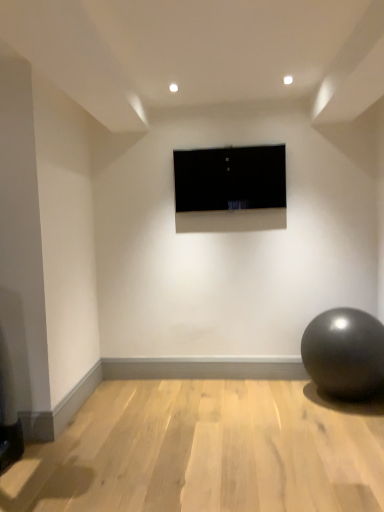
Describe the element at coordinates (230, 178) in the screenshot. I see `black glossy tv at center` at that location.

At what (x,y) coordinates should I click in order to perform the action: click on black glossy tv at center. Please return your answer as a coordinate pair (x, y). The width and height of the screenshot is (384, 512). Looking at the image, I should click on (230, 178).

Locate an element on the screen. shiny metallic ball at lower right is located at coordinates (344, 353).

Measure the distance between shiny metallic ball at lower right and camera.

2.86 meters.

The height and width of the screenshot is (512, 384). What do you see at coordinates (344, 353) in the screenshot?
I see `shiny metallic ball at lower right` at bounding box center [344, 353].

The height and width of the screenshot is (512, 384). Find the location of `black glossy tv at center`. black glossy tv at center is located at coordinates (230, 178).

Is shiny metallic ball at lower right to the left of black glossy tv at center from the viewer's perspective?

In fact, shiny metallic ball at lower right is to the right of black glossy tv at center.

Is shiny metallic ball at lower right behind black glossy tv at center?

No, shiny metallic ball at lower right is closer to the viewer.

Between point (324, 331) and point (241, 178), which one is positioned behind?

Positioned behind is point (241, 178).

From the image's perspective, who appears lower, shiny metallic ball at lower right or black glossy tv at center?

shiny metallic ball at lower right is shown below in the image.

From a real-world perspective, between shiny metallic ball at lower right and black glossy tv at center, who is vertically higher?

In real-world perspective, black glossy tv at center is above.

Considering the sizes of objects shiny metallic ball at lower right and black glossy tv at center in the image provided, who is thinner, shiny metallic ball at lower right or black glossy tv at center?

black glossy tv at center.

Is shiny metallic ball at lower right taller than black glossy tv at center?

Correct, shiny metallic ball at lower right is much taller as black glossy tv at center.

Can you confirm if shiny metallic ball at lower right is smaller than black glossy tv at center?

No, shiny metallic ball at lower right is not smaller than black glossy tv at center.

Can we say shiny metallic ball at lower right lies outside black glossy tv at center?

That's correct, shiny metallic ball at lower right is outside of black glossy tv at center.

Are shiny metallic ball at lower right and black glossy tv at center making contact?

No, shiny metallic ball at lower right is not making contact with black glossy tv at center.

Is shiny metallic ball at lower right oriented towards black glossy tv at center?

No, shiny metallic ball at lower right is not facing towards black glossy tv at center.

How many degrees apart are the facing directions of shiny metallic ball at lower right and black glossy tv at center?

The facing directions of shiny metallic ball at lower right and black glossy tv at center are 1.16 degrees apart.

You are a GUI agent. You are given a task and a screenshot of the screen. Output one action in this format:
    pyautogui.click(x=<x>, y=<y>)
    Task: Click on the television above the shiny metallic ball at lower right (from a real-world perspective)
    
    Given the screenshot: What is the action you would take?
    pyautogui.click(x=230, y=178)

In the scene shown: In the image, is black glossy tv at center on the left side or the right side of shiny metallic ball at lower right?

Clearly, black glossy tv at center is on the left of shiny metallic ball at lower right in the image.

Which object is closer to the camera taking this photo, black glossy tv at center or shiny metallic ball at lower right?

shiny metallic ball at lower right.

Which is closer to the camera, (274, 169) or (324, 350)?

The point (324, 350) is closer.

From the image's perspective, is black glossy tv at center on shiny metallic ball at lower right?

Yes, from the image's perspective, black glossy tv at center is on top of shiny metallic ball at lower right.

From a real-world perspective, is black glossy tv at center above or below shiny metallic ball at lower right?

From a real-world perspective, black glossy tv at center is physically above shiny metallic ball at lower right.

Between black glossy tv at center and shiny metallic ball at lower right, which one has smaller width?

With smaller width is black glossy tv at center.

Can you confirm if black glossy tv at center is shorter than shiny metallic ball at lower right?

Indeed, black glossy tv at center has a lesser height compared to shiny metallic ball at lower right.

Does black glossy tv at center have a smaller size compared to shiny metallic ball at lower right?

Correct, black glossy tv at center occupies less space than shiny metallic ball at lower right.

Is black glossy tv at center not inside shiny metallic ball at lower right?

Yes, black glossy tv at center is located beyond the bounds of shiny metallic ball at lower right.

Is there a large distance between black glossy tv at center and shiny metallic ball at lower right?

Indeed, black glossy tv at center is not near shiny metallic ball at lower right.

Is black glossy tv at center turned away from shiny metallic ball at lower right?

No, shiny metallic ball at lower right is not at the back of black glossy tv at center.

How different are the orientations of black glossy tv at center and shiny metallic ball at lower right in degrees?

1.16 degrees.

At what (x,y) coordinates should I click in order to perform the action: click on ball that appears in front of the black glossy tv at center. Please return your answer as a coordinate pair (x, y). Looking at the image, I should click on (344, 353).

What are the coordinates of `ball in front of the black glossy tv at center` in the screenshot? It's located at (344, 353).

At what (x,y) coordinates should I click in order to perform the action: click on television located above the shiny metallic ball at lower right (from the image's perspective). Please return your answer as a coordinate pair (x, y). Looking at the image, I should click on (230, 178).